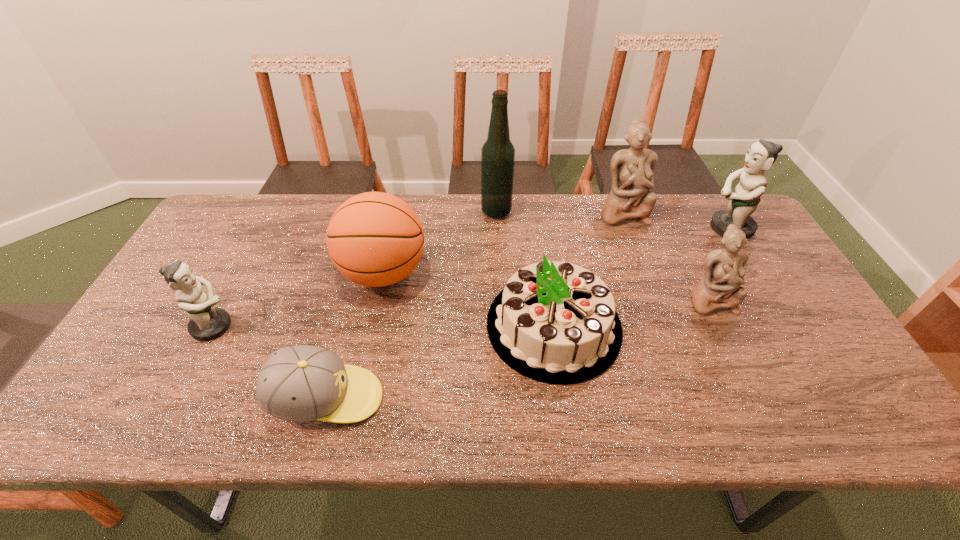
Find the location of a particular element. The width and height of the screenshot is (960, 540). figurine that is the third closest to the rightmost object is located at coordinates coord(207,322).

Identify which figurine is the closest to the second figurine from left to right. Please provide its 2D coordinates. Your answer should be formatted as a tuple, i.e. [(x, y)], where the tuple contains the x and y coordinates of a point satisfying the conditions above.

[(761, 155)]

Where is `free region that satisfies the following two spatial constraints: 1. on the front side of the orange basketball; 2. on the front-facing side of the shortest object`? free region that satisfies the following two spatial constraints: 1. on the front side of the orange basketball; 2. on the front-facing side of the shortest object is located at coordinates click(x=357, y=398).

At what (x,y) coordinates should I click in order to perform the action: click on vacant space that satisfies the following two spatial constraints: 1. on the front-facing side of the left white figurine; 2. on the front-facing side of the leftmost object. Please return your answer as a coordinate pair (x, y). This screenshot has width=960, height=540. Looking at the image, I should click on (664, 327).